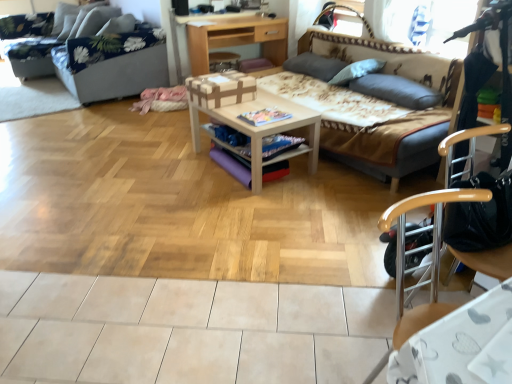
Question: Is floral fabric studio couch at upper left, arranged as the 2th studio couch when viewed from the right, facing towards gray fabric pillow at upper right, marked as the first pillow in a front-to-back arrangement?

Choices:
 (A) yes
 (B) no

Answer: (B)

Question: Is the position of floral fabric studio couch at upper left, the first studio couch when ordered from left to right, less distant than that of gray fabric pillow at upper right, marked as the first pillow in a front-to-back arrangement?

Choices:
 (A) yes
 (B) no

Answer: (B)

Question: From a real-world perspective, is floral fabric studio couch at upper left, arranged as the 2th studio couch when viewed from the right, positioned under gray fabric pillow at upper right, placed as the 3th pillow when sorted from back to front, based on gravity?

Choices:
 (A) no
 (B) yes

Answer: (B)

Question: Is floral fabric studio couch at upper left, the first studio couch when ordered from left to right, turned away from gray fabric pillow at upper right, marked as the first pillow in a front-to-back arrangement?

Choices:
 (A) yes
 (B) no

Answer: (B)

Question: Is floral fabric studio couch at upper left, the first studio couch when ordered from left to right, to the left of gray fabric pillow at upper right, marked as the first pillow in a front-to-back arrangement, from the viewer's perspective?

Choices:
 (A) no
 (B) yes

Answer: (B)

Question: Is the depth of floral fabric studio couch at upper left, arranged as the 2th studio couch when viewed from the right, greater than that of gray fabric pillow at upper right, marked as the first pillow in a front-to-back arrangement?

Choices:
 (A) no
 (B) yes

Answer: (B)

Question: Can we say gray fabric pillow at upper right, marked as the second pillow in a front-to-back arrangement, lies outside brown fabric studio couch at center, the 1th studio couch when ordered from right to left?

Choices:
 (A) no
 (B) yes

Answer: (A)

Question: Is gray fabric pillow at upper right, the second pillow viewed from the back, wider than brown fabric studio couch at center, which is the 2th studio couch in left-to-right order?

Choices:
 (A) no
 (B) yes

Answer: (A)

Question: Is gray fabric pillow at upper right, marked as the second pillow in a front-to-back arrangement, closer to camera compared to brown fabric studio couch at center, the 1th studio couch when ordered from right to left?

Choices:
 (A) no
 (B) yes

Answer: (A)

Question: From a real-world perspective, is gray fabric pillow at upper right, the second pillow viewed from the back, physically above brown fabric studio couch at center, which is the 2th studio couch in left-to-right order?

Choices:
 (A) yes
 (B) no

Answer: (A)

Question: Is the position of gray fabric pillow at upper right, marked as the second pillow in a front-to-back arrangement, more distant than that of brown fabric studio couch at center, the 1th studio couch when ordered from right to left?

Choices:
 (A) yes
 (B) no

Answer: (A)

Question: Does gray fabric pillow at upper right, the second pillow viewed from the back, appear on the left side of brown fabric studio couch at center, which is the 2th studio couch in left-to-right order?

Choices:
 (A) no
 (B) yes

Answer: (A)

Question: Considering the relative sizes of floral fabric studio couch at upper left, the first studio couch when ordered from left to right, and wooden desk at center in the image provided, is floral fabric studio couch at upper left, the first studio couch when ordered from left to right, taller than wooden desk at center?

Choices:
 (A) yes
 (B) no

Answer: (A)